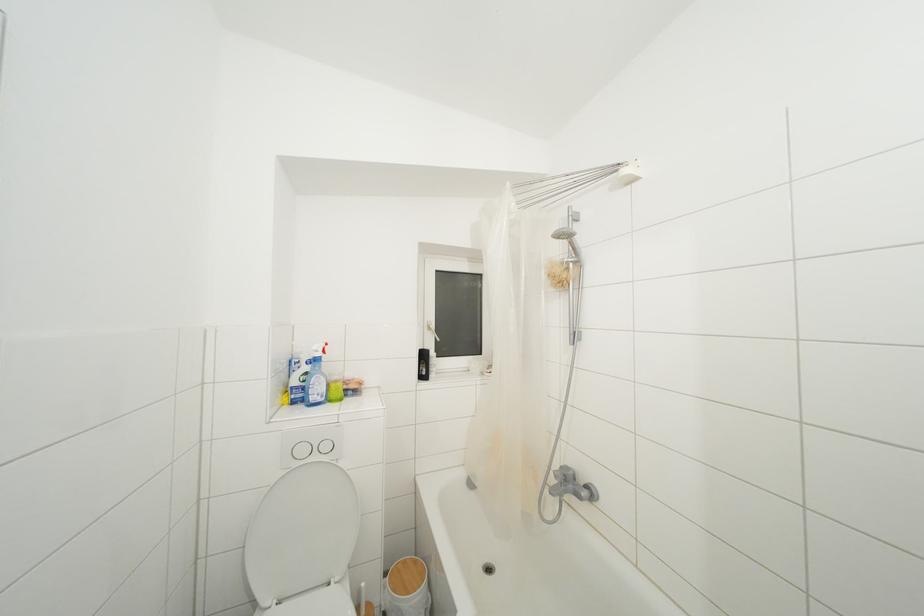
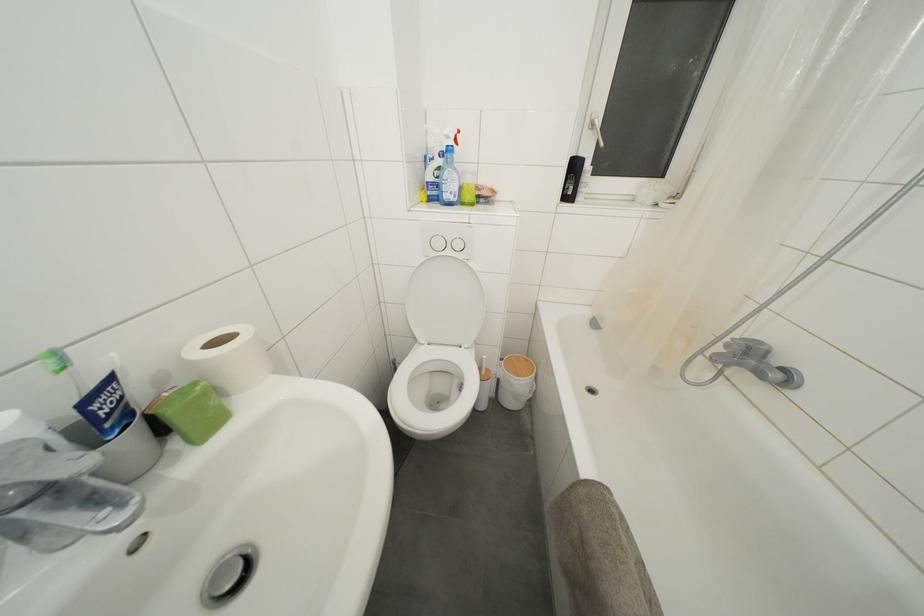
Find the pixel in the second image that matches the point at 307,456 in the first image.

(443, 249)